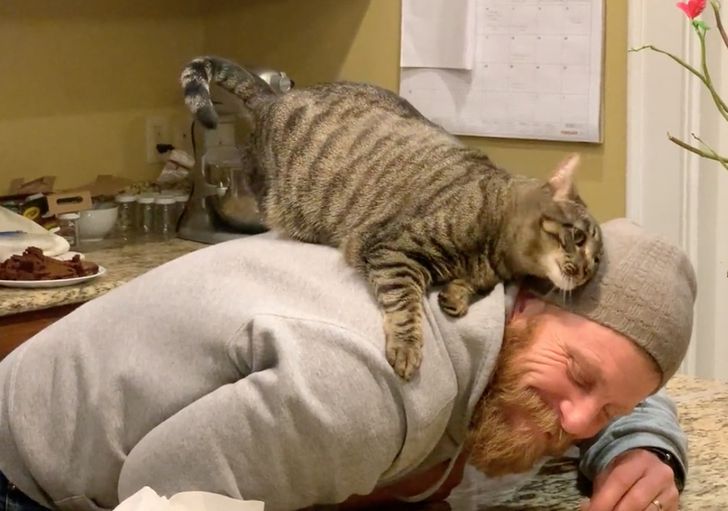
Where is `counter`? counter is located at coordinates (140, 268).